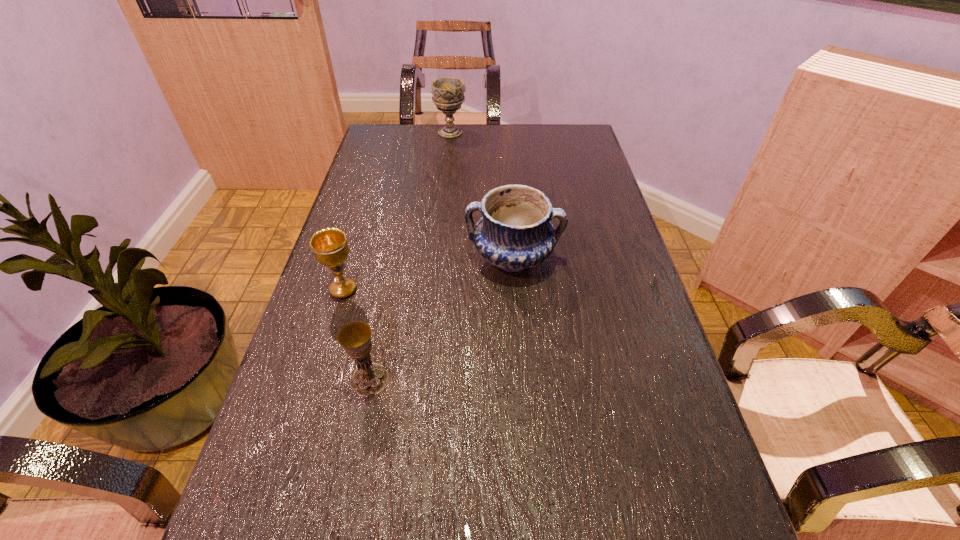
Locate an element on the screen. vacant area in the image that satisfies the following two spatial constraints: 1. on the back side of the pottery; 2. on the right side of the nearest chalice is located at coordinates (394, 258).